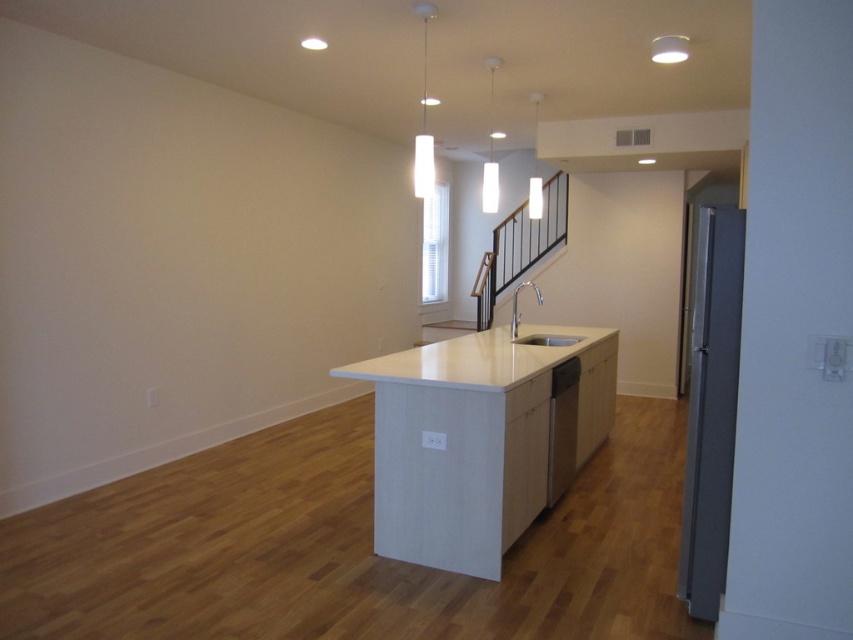
You are a chef preparing a meal and need to place a heavy cutting board on the white laminate counter top at center and the white glossy sink at center. Which surface can better support the weight without bending or breaking?

The white laminate counter top at center has a greater height compared to the white glossy sink at center, so it is more likely to support the weight of the cutting board without bending or breaking.

You are standing in the kitchen and want to reach both the point at coordinates (450,348) and the point at coordinates (535,342). Which point will you reach first?

You will reach the point at coordinates (450,348) first because it is closer to you than the point at coordinates (535,342).

You are designing a kitchen layout and need to place both the white matte dishwasher at center and the white glossy sink at center on the same countertop. Which appliance should you allocate more space for?

The white glossy sink at center requires more space since it is larger than the white matte dishwasher at center.